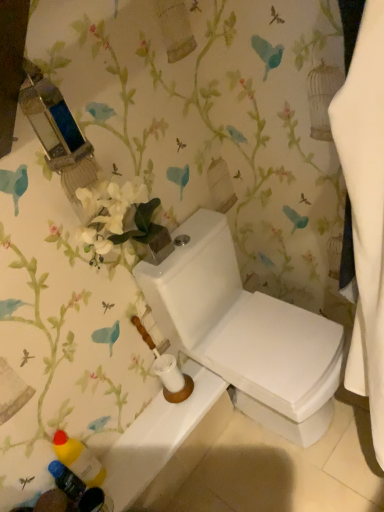
Question: Is white glossy toilet at center facing away from blue plastic bottle at lower left, marked as the 2th toiletry in a top-to-bottom arrangement?

Choices:
 (A) no
 (B) yes

Answer: (A)

Question: From the image's perspective, is white glossy toilet at center beneath blue plastic bottle at lower left, which ranks as the 1th toiletry in bottom-to-top order?

Choices:
 (A) yes
 (B) no

Answer: (B)

Question: Can you confirm if white glossy toilet at center is bigger than blue plastic bottle at lower left, which ranks as the 1th toiletry in bottom-to-top order?

Choices:
 (A) yes
 (B) no

Answer: (A)

Question: Are white glossy toilet at center and blue plastic bottle at lower left, which ranks as the 1th toiletry in bottom-to-top order, located far from each other?

Choices:
 (A) yes
 (B) no

Answer: (B)

Question: Is the depth of white glossy toilet at center less than that of blue plastic bottle at lower left, marked as the 2th toiletry in a top-to-bottom arrangement?

Choices:
 (A) yes
 (B) no

Answer: (A)

Question: From their relative heights in the image, would you say white glossy toilet at lower center is taller or shorter than white glossy toilet at center?

Choices:
 (A) tall
 (B) short

Answer: (B)

Question: Relative to white glossy toilet at center, is white glossy toilet at lower center in front or behind?

Choices:
 (A) behind
 (B) front

Answer: (A)

Question: Looking at their shapes, would you say white glossy toilet at lower center is wider or thinner than white glossy toilet at center?

Choices:
 (A) wide
 (B) thin

Answer: (B)

Question: From the image's perspective, is white glossy toilet at lower center above or below white glossy toilet at center?

Choices:
 (A) above
 (B) below

Answer: (B)

Question: Is blue plastic bottle at lower left, which ranks as the 1th toiletry in bottom-to-top order, taller or shorter than white glossy toilet at center?

Choices:
 (A) short
 (B) tall

Answer: (A)

Question: Is blue plastic bottle at lower left, which ranks as the 1th toiletry in bottom-to-top order, situated inside white glossy toilet at center or outside?

Choices:
 (A) inside
 (B) outside

Answer: (B)

Question: Relative to white glossy toilet at center, is blue plastic bottle at lower left, which ranks as the 1th toiletry in bottom-to-top order, in front or behind?

Choices:
 (A) behind
 (B) front

Answer: (A)

Question: From the image's perspective, relative to white glossy toilet at center, is blue plastic bottle at lower left, which ranks as the 1th toiletry in bottom-to-top order, above or below?

Choices:
 (A) above
 (B) below

Answer: (B)

Question: Would you say white glossy toilet at center is to the left or to the right of white glossy toilet at lower center in the picture?

Choices:
 (A) right
 (B) left

Answer: (A)

Question: Is white glossy toilet at center situated inside white glossy toilet at lower center or outside?

Choices:
 (A) outside
 (B) inside

Answer: (A)